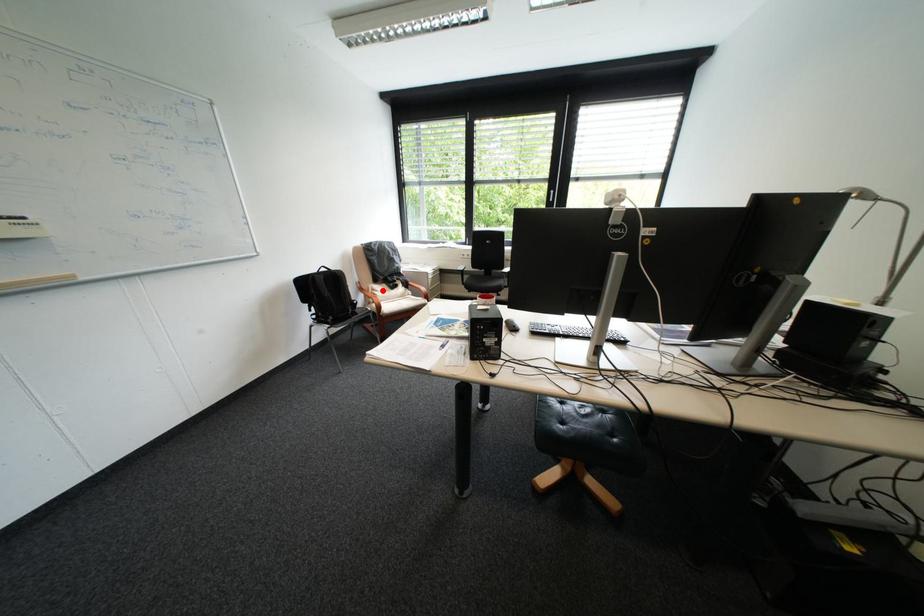
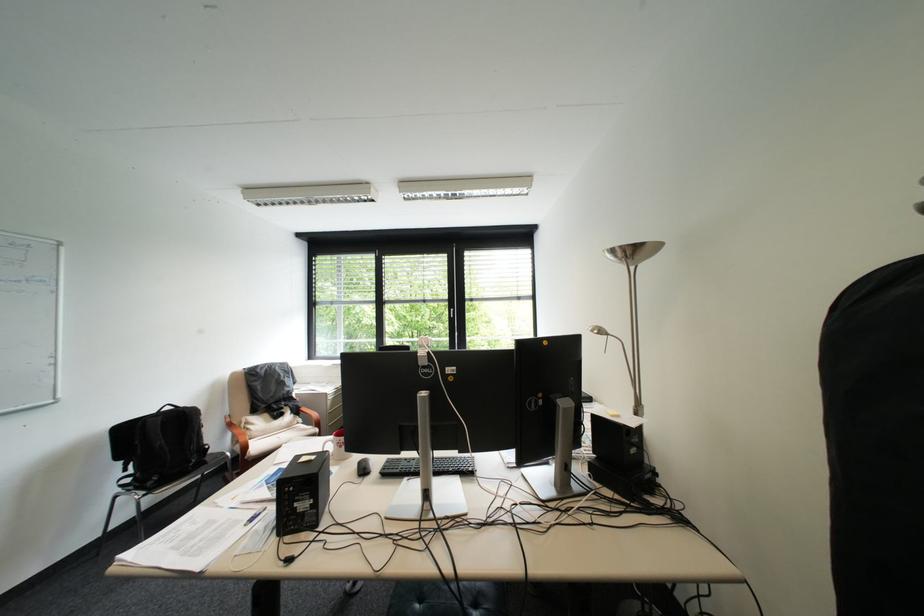
Question: A red point is marked in image1. In image2, is the corresponding 3D point closer to the camera or farther? Reply with the corresponding letter.

Choices:
 (A) The corresponding 3D point is closer.
 (B) The corresponding 3D point is farther.

Answer: (B)